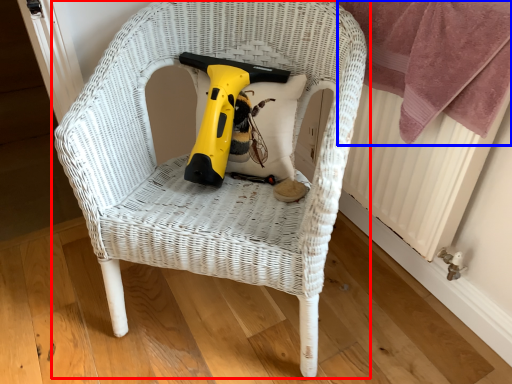
Question: Which object is closer to the camera taking this photo, chair (highlighted by a red box) or blanket (highlighted by a blue box)?

Choices:
 (A) chair
 (B) blanket

Answer: (A)